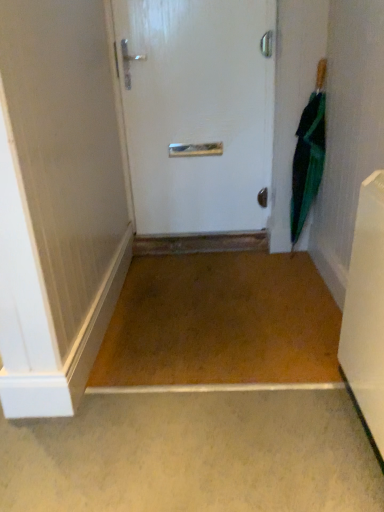
Question: Do you think white plastic radiator at lower right is within white glossy door at center, or outside of it?

Choices:
 (A) inside
 (B) outside

Answer: (B)

Question: Visually, is white plastic radiator at lower right positioned to the left or to the right of white glossy door at center?

Choices:
 (A) right
 (B) left

Answer: (A)

Question: Estimate the real-world distances between objects in this image. Which object is farther from the green matte umbrella at right?

Choices:
 (A) white glossy door at center
 (B) white plastic radiator at lower right

Answer: (B)

Question: Which object is positioned closest to the white plastic radiator at lower right?

Choices:
 (A) green matte umbrella at right
 (B) white glossy door at center

Answer: (A)